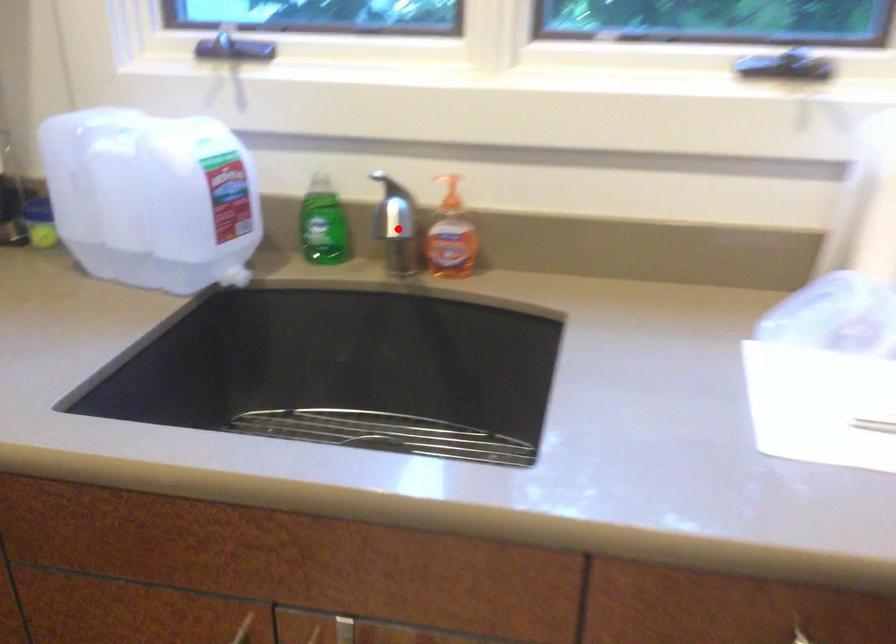
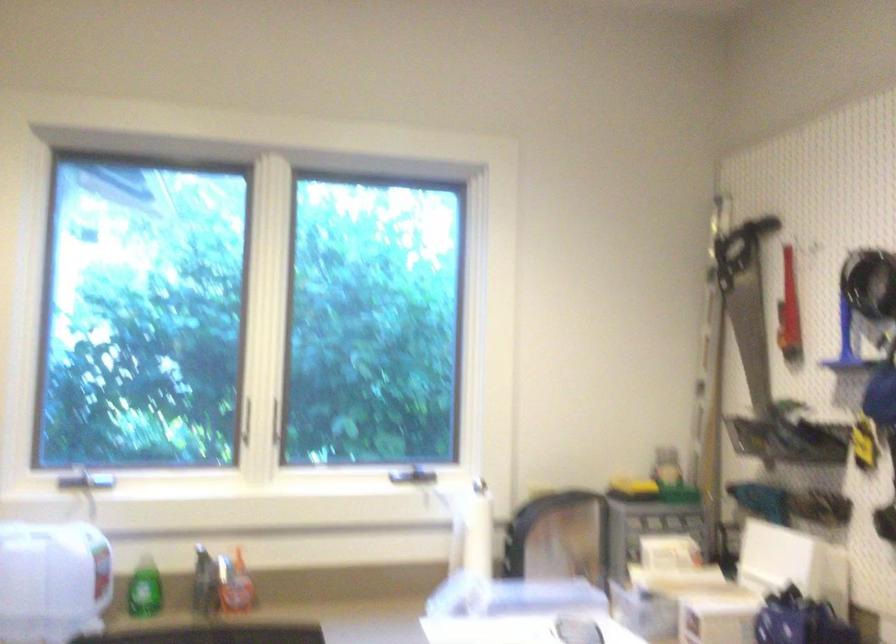
Where in the second image is the point corresponding to the highlighted location from the first image?

(204, 583)